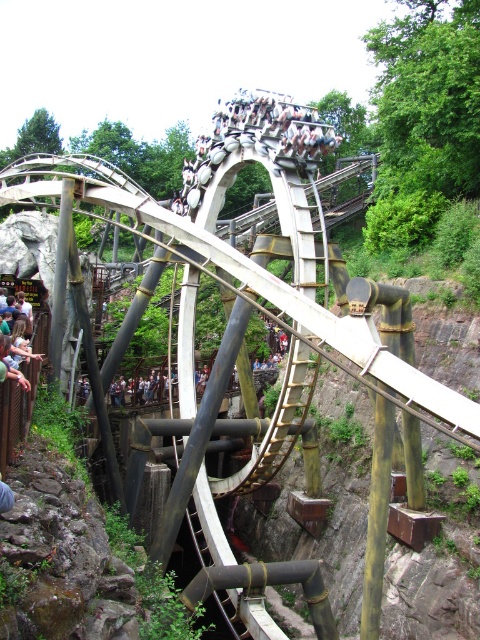
You are a park maintenance worker who needs to place a new bench. The bench is 2 meters wide. There is a metallic silver roller coaster at center and a light brown wooden sign at lower left. Can the bench be placed between them without touching either?

The metallic silver roller coaster at center might be wider than light brown wooden sign at lower left, so the distance between them is uncertain. Therefore, the bench might not fit safely between them without touching either object.

You are standing at the entrance of the amusement park and see the metallic silver roller coaster at center and the light brown wooden sign at lower left. Which object is closer to you?

The light brown wooden sign at lower left is closer to you because the metallic silver roller coaster at center is positioned over it, meaning it is in front of the sign.